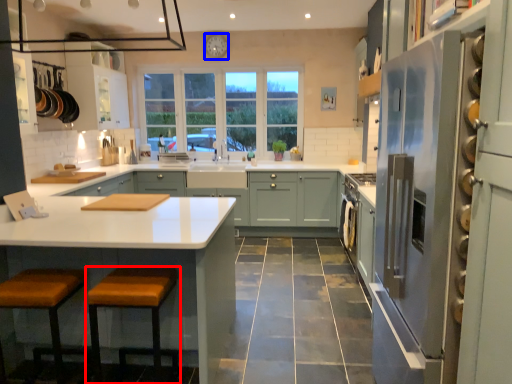
Question: Which object is further to the camera taking this photo, stool (highlighted by a red box) or clock (highlighted by a blue box)?

Choices:
 (A) stool
 (B) clock

Answer: (B)